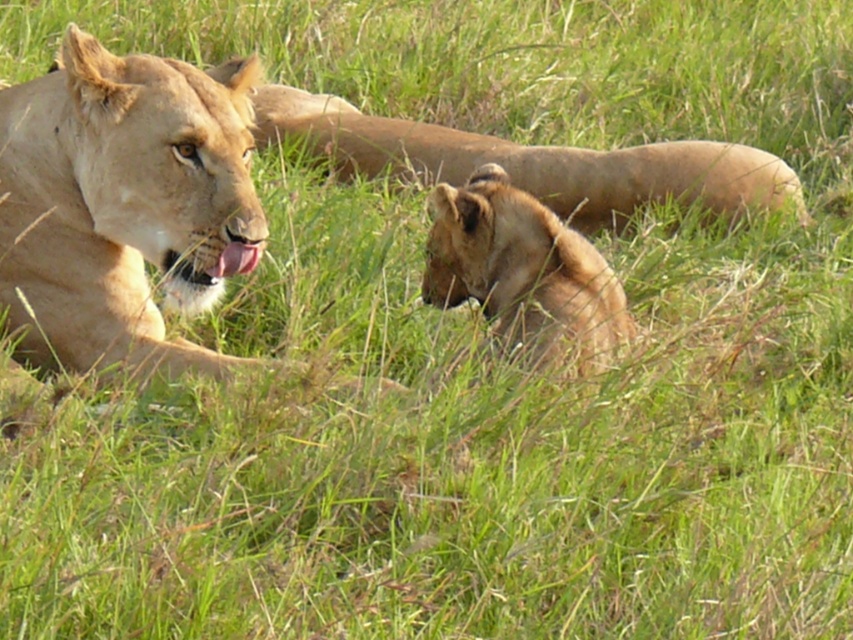
Does golden fur lion at center have a lesser height compared to golden fur lion cub at center?

Incorrect, golden fur lion at center's height does not fall short of golden fur lion cub at center's.

Does golden fur lion at center appear on the right side of golden fur lion cub at center?

Correct, you'll find golden fur lion at center to the right of golden fur lion cub at center.

Which is behind, point (567, 179) or point (589, 244)?

Positioned behind is point (567, 179).

Identify the location of golden fur lion at center. (532, 161).

Is point (25, 145) closer to viewer compared to point (749, 148)?

Yes, point (25, 145) is closer to viewer.

Does light brown fur lion at left have a lesser height compared to golden fur lion at center?

In fact, light brown fur lion at left may be taller than golden fur lion at center.

Who is more distant from viewer, [132,193] or [339,140]?

The point [339,140] is behind.

Image resolution: width=853 pixels, height=640 pixels. In order to click on light brown fur lion at left in this screenshot , I will do `click(123, 205)`.

How distant is light brown fur lion at left from golden fur lion cub at center?

A distance of 31.28 inches exists between light brown fur lion at left and golden fur lion cub at center.

Between light brown fur lion at left and golden fur lion cub at center, which one appears on the right side from the viewer's perspective?

golden fur lion cub at center is more to the right.

Which is in front, point (227, 192) or point (440, 250)?

Point (227, 192) is in front.

You are a GUI agent. You are given a task and a screenshot of the screen. Output one action in this format:
    pyautogui.click(x=<x>, y=<y>)
    Task: Click on the light brown fur lion at left
    This screenshot has width=853, height=640.
    Given the screenshot: What is the action you would take?
    pyautogui.click(x=123, y=205)